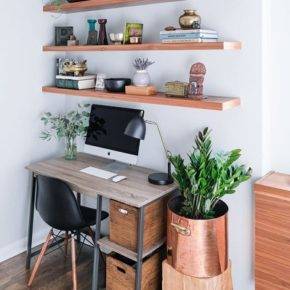
Find the location of a particular element. urn is located at coordinates (187, 21).